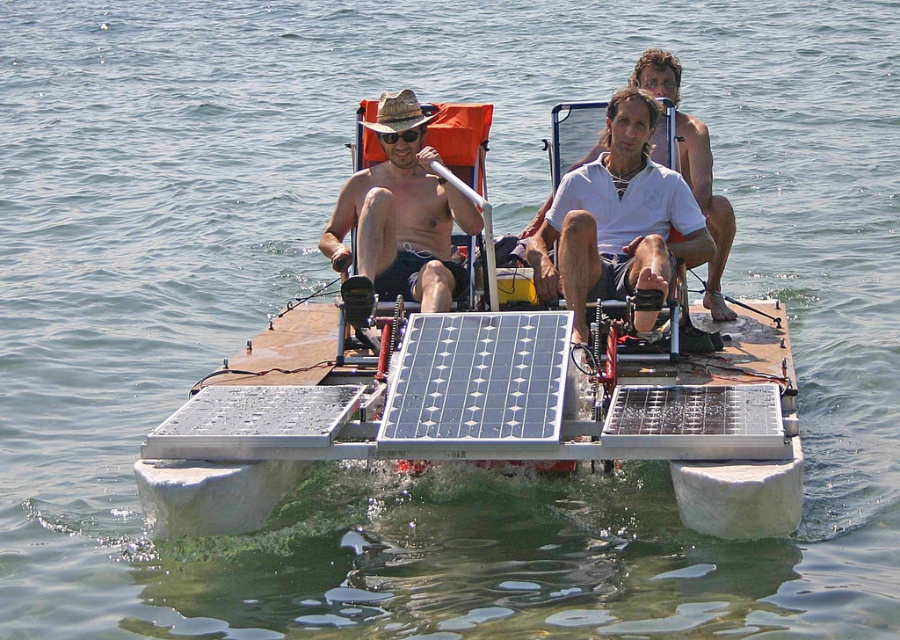
Question: Which object is farther from the camera taking this photo?

Choices:
 (A) white matte shirt at center
 (B) matte black goggles at center
 (C) silvery metallic solar panel at center

Answer: (A)

Question: Considering the relative positions of matte straw hat at center and white matte shirt at center in the image provided, where is matte straw hat at center located with respect to white matte shirt at center?

Choices:
 (A) below
 (B) above

Answer: (A)

Question: Can you confirm if silvery metallic solar panel at center is thinner than matte black goggles at center?

Choices:
 (A) yes
 (B) no

Answer: (B)

Question: Which of these objects is positioned farthest from the matte black goggles at center?

Choices:
 (A) white matte shirt at center
 (B) silvery metallic solar panel at center
 (C) matte straw hat at center

Answer: (B)

Question: Which object is closer to the camera taking this photo?

Choices:
 (A) silvery metallic solar panel at center
 (B) matte black goggles at center

Answer: (A)

Question: In this image, where is silvery metallic solar panel at center located relative to white matte shirt at center?

Choices:
 (A) right
 (B) left

Answer: (B)